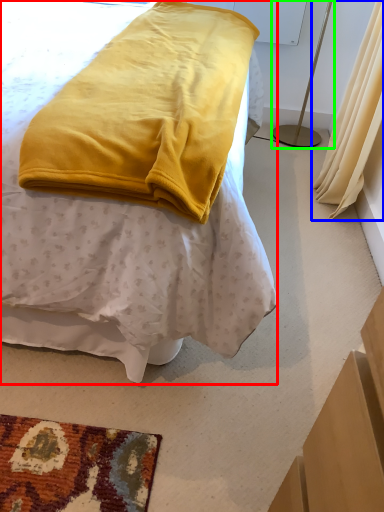
Question: Considering the real-world distances, which object is closest to bed (highlighted by a red box)? curtain (highlighted by a blue box) or bedside lamp (highlighted by a green box).

Choices:
 (A) curtain
 (B) bedside lamp

Answer: (A)